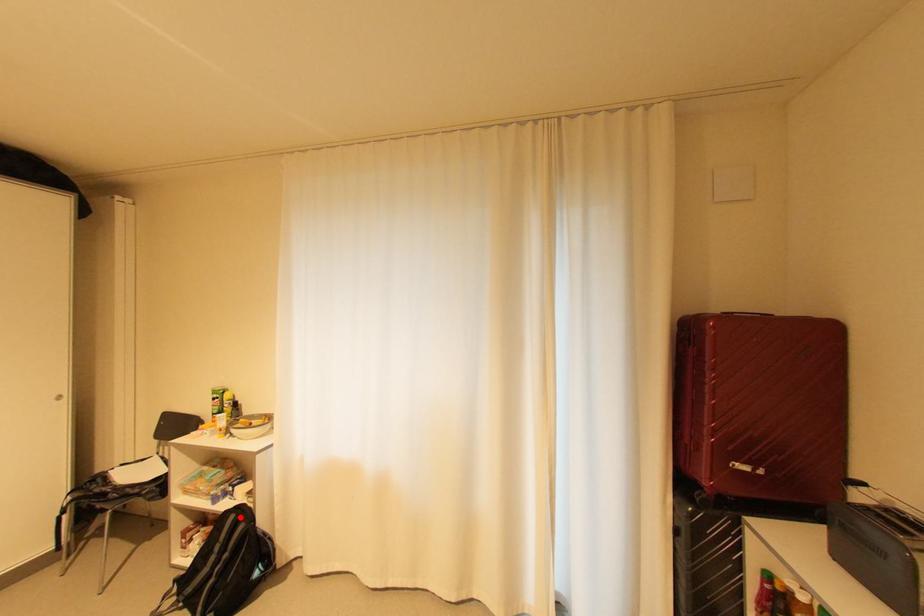
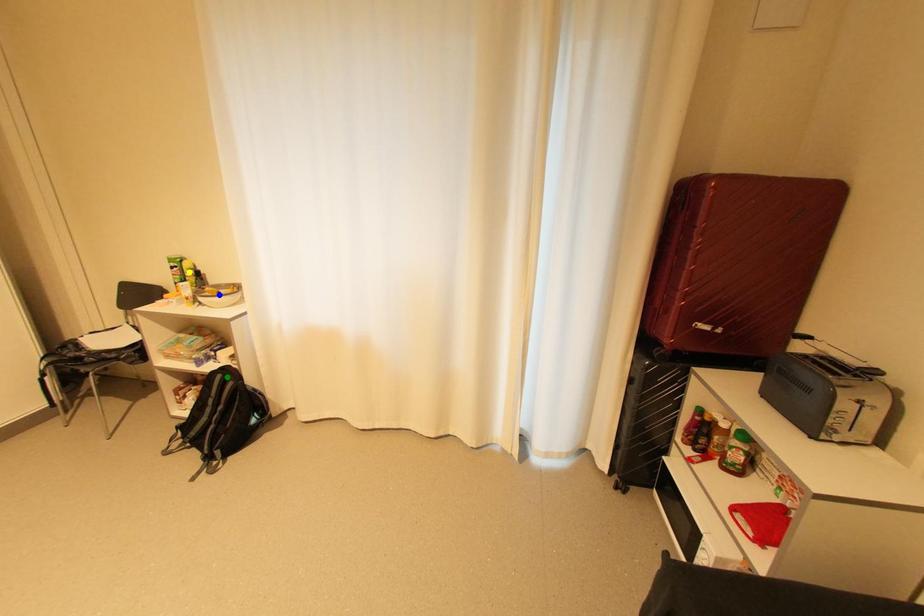
Question: I am providing you with two images of the same scene from different viewpoints. A red point is marked on the first image. You are given multiple points on the second image. Which point in image 2 is actually the same real-world point as the red point in image 1?

Choices:
 (A) yellow point
 (B) blue point
 (C) green point

Answer: (C)